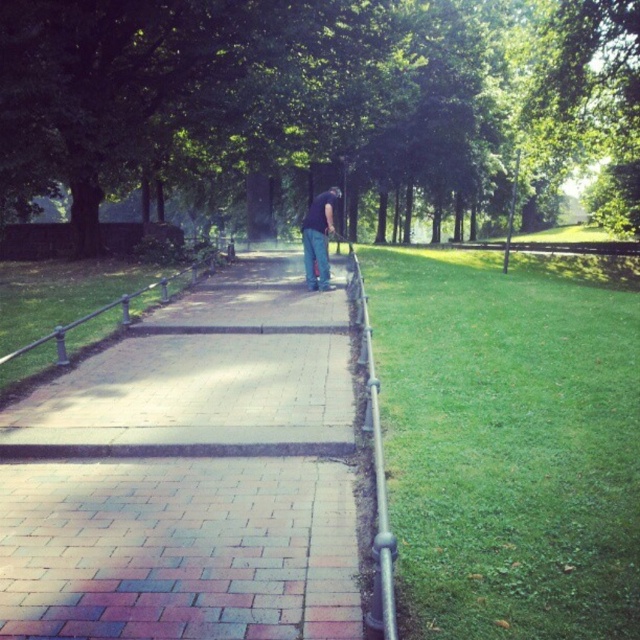
You are a park visitor who wants to walk along the brick paved walkway at center. However, you notice the dark blue jeans at center nearby. Which object occupies more space in the scene?

The dark blue jeans at center occupies more space in the scene than the brick paved walkway at center, as the brick paved walkway at center has a smaller size compared to dark blue jeans at center.

From the picture: You are a maintenance worker in the park and you need to reach the silver metallic rail at center to fix it. However, you are currently standing behind the dark blue jeans at center. Can you directly access the rail without moving the jeans?

The silver metallic rail at center is positioned under dark blue jeans at center, so you can directly access the rail without needing to move the jeans since it is underneath.

You are a maintenance worker standing on the green grass at right. You need to reach the silver metallic rail at center to fix it. Given that your longest tool is 15 feet long, will you be able to reach the rail without moving closer?

The distance between the green grass at right and the silver metallic rail at center is 17.78 feet, which is longer than your 15 feet tool. Therefore, you cannot reach the rail without moving closer.